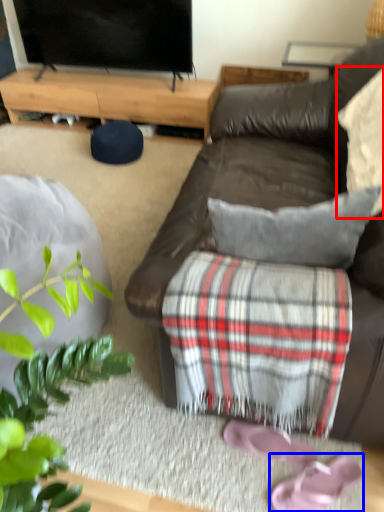
Question: Among these objects, which one is nearest to the camera, pillow (highlighted by a red box) or footwear (highlighted by a blue box)?

Choices:
 (A) pillow
 (B) footwear

Answer: (A)